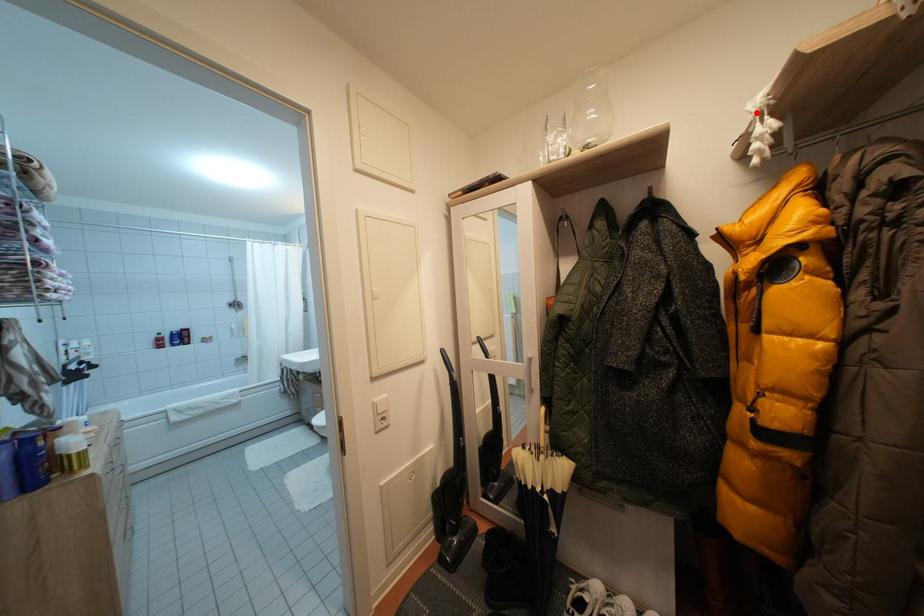
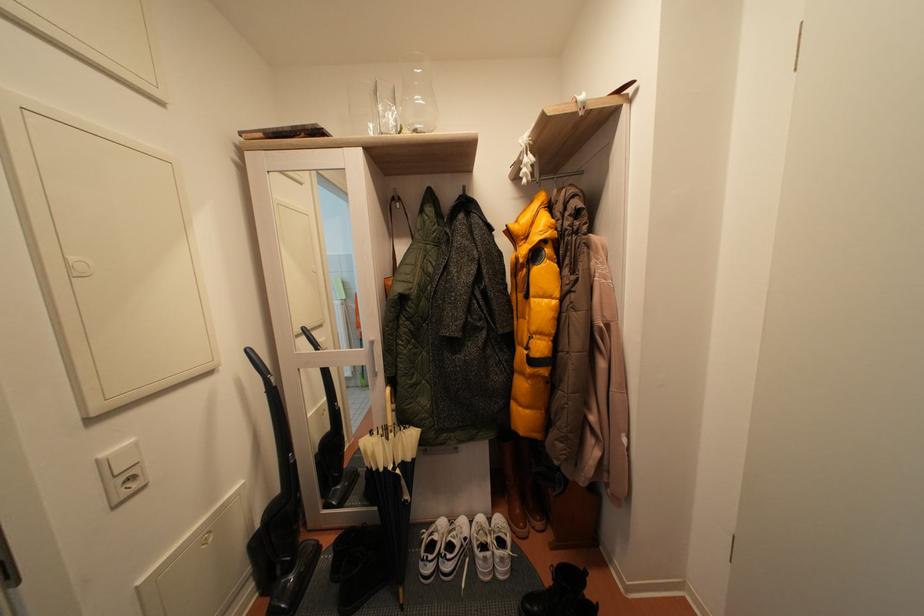
Where in the second image is the point corresponding to the highlighted location from the first image?

(528, 147)